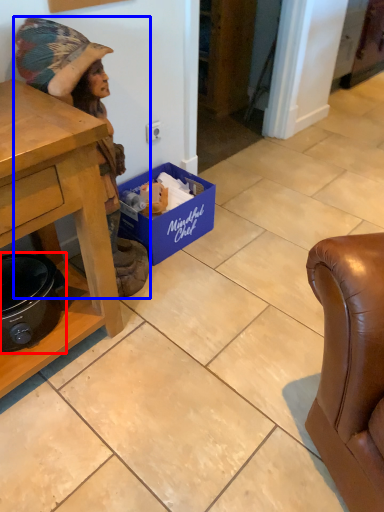
Question: Which point is further to the camera, appliance (highlighted by a red box) or person (highlighted by a blue box)?

Choices:
 (A) appliance
 (B) person

Answer: (A)